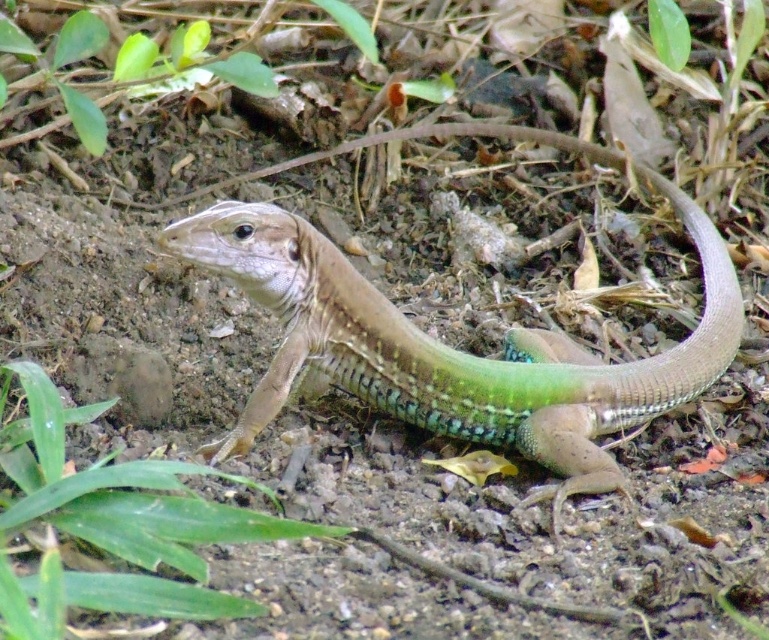
In the scene shown: You are a wildlife photographer trying to capture the green scaly lizard at center and the green leafy grass at lower left in a single frame. Based on their sizes, which object would appear larger in the photo?

The green scaly lizard at center would appear larger in the photo because its width surpasses that of the green leafy grass at lower left.

You are observing a lizard in a natural setting. You notice two points marked on the image at coordinates point [671,202] and point [68,515]. Which of these points is closer to you?

Point [671,202] is further to the viewer than point [68,515], so the point closer to you is point [68,515].

You are a hiker who wants to take a photo of the green scaly lizard at center. You notice a point at coordinate (454,349). What is located at that point?

At point (454,349) lies the green scaly lizard at center.